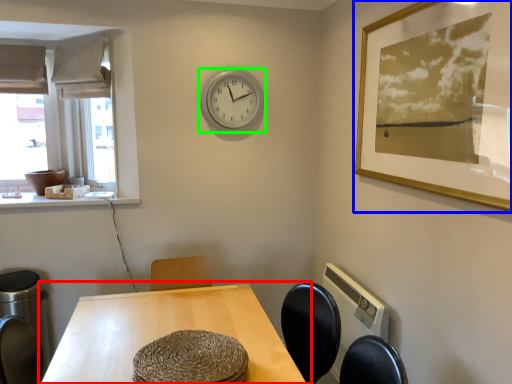
Question: Which is farther away from table (highlighted by a red box)? picture frame (highlighted by a blue box) or wall clock (highlighted by a green box)?

Choices:
 (A) picture frame
 (B) wall clock

Answer: (B)